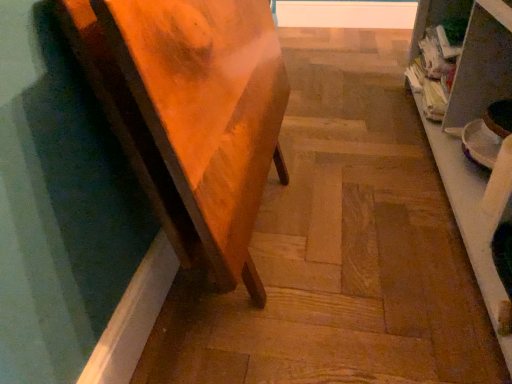
Question: Considering the relative sizes of wooden step at center and wooden table at left in the image provided, is wooden step at center thinner than wooden table at left?

Choices:
 (A) yes
 (B) no

Answer: (B)

Question: From a real-world perspective, is wooden step at center on wooden table at left?

Choices:
 (A) yes
 (B) no

Answer: (B)

Question: From the image's perspective, is wooden step at center located above wooden table at left?

Choices:
 (A) no
 (B) yes

Answer: (B)

Question: Does wooden step at center have a larger size compared to wooden table at left?

Choices:
 (A) no
 (B) yes

Answer: (A)

Question: Can you confirm if wooden step at center is shorter than wooden table at left?

Choices:
 (A) no
 (B) yes

Answer: (B)

Question: Is wooden step at center wider than wooden table at left?

Choices:
 (A) yes
 (B) no

Answer: (A)

Question: Is wooden step at center turned away from white glossy shelf at right?

Choices:
 (A) no
 (B) yes

Answer: (A)

Question: Considering the relative sizes of wooden step at center and white glossy shelf at right in the image provided, is wooden step at center shorter than white glossy shelf at right?

Choices:
 (A) yes
 (B) no

Answer: (A)

Question: Could you tell me if wooden step at center is turned towards white glossy shelf at right?

Choices:
 (A) no
 (B) yes

Answer: (A)

Question: From a real-world perspective, does wooden step at center stand above white glossy shelf at right?

Choices:
 (A) yes
 (B) no

Answer: (B)

Question: Could white glossy shelf at right be considered to be inside wooden step at center?

Choices:
 (A) no
 (B) yes

Answer: (A)

Question: Can you confirm if wooden step at center is wider than white glossy shelf at right?

Choices:
 (A) yes
 (B) no

Answer: (A)

Question: From a real-world perspective, is wooden table at left positioned over wooden step at center based on gravity?

Choices:
 (A) no
 (B) yes

Answer: (B)